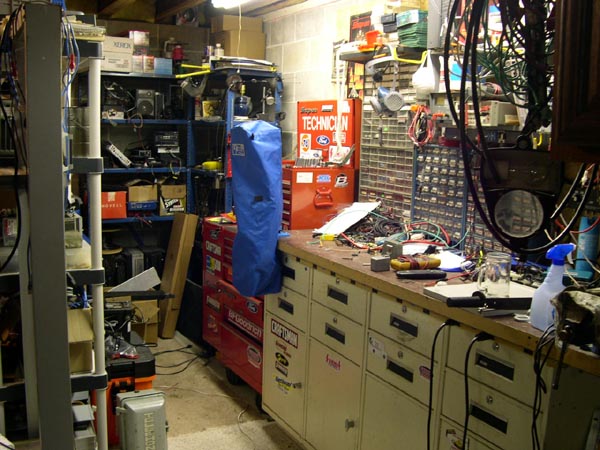
At what (x,y) coordinates should I click in order to perform the action: click on spray bottle. Please return your answer as a coordinate pair (x, y). This screenshot has height=450, width=600. Looking at the image, I should click on (538, 310).